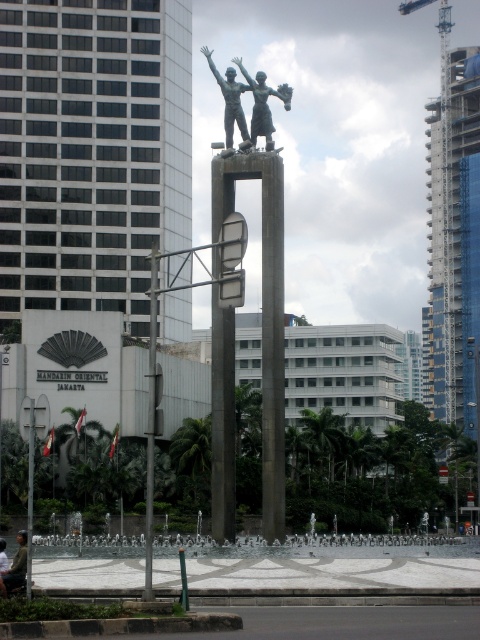
What are the coordinates of the glassy blue skyscraper at right?

The glassy blue skyscraper at right is located at coordinates point [455,237].

You are a photographer planning to capture the glassy blue skyscraper at right and the polished bronze statue at center in a single shot. Given that the skyscraper is larger in the scene, which object should you position closer to the camera to ensure both appear balanced in size within the frame?

To balance the sizes of the glassy blue skyscraper at right and the polished bronze statue at center in the photo, position the polished bronze statue at center closer to the camera since it is smaller than the skyscraper. This will make both appear more equal in size in the final image.

You are standing in the plaza facing the polished bronze statue at center. To your left, you notice the glassy blue skyscraper at right. Is the skyscraper actually located to the right or left of the statue from your viewpoint?

The glassy blue skyscraper at right is to the right of the polished bronze statue at center from your viewpoint.